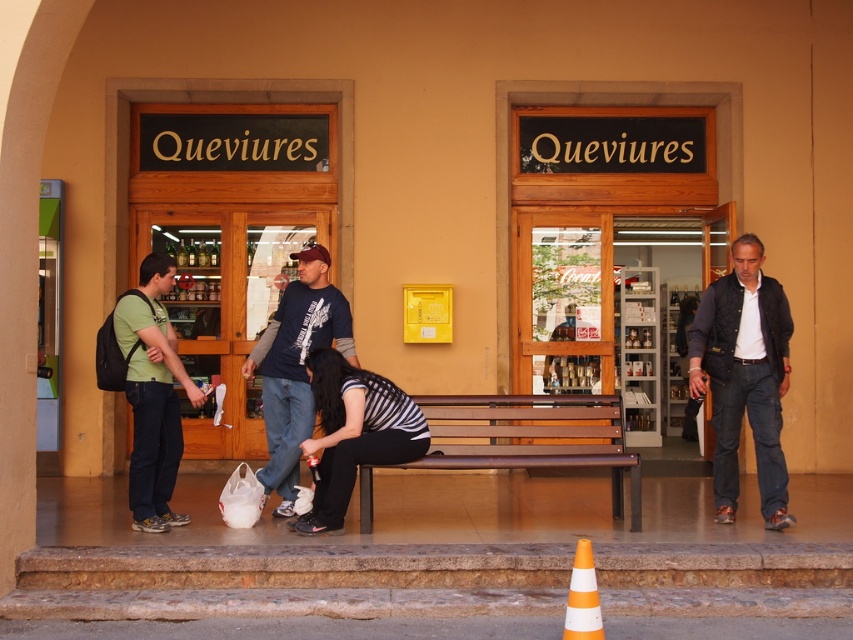
Question: Where is brown stone stairs at lower center located in relation to brown wooden bench at center in the image?

Choices:
 (A) below
 (B) above

Answer: (A)

Question: Can you confirm if matte green t-shirt at left is positioned to the left of dark blue t-shirt at center?

Choices:
 (A) yes
 (B) no

Answer: (A)

Question: Among these points, which one is farthest from the camera?

Choices:
 (A) (764, 385)
 (B) (351, 380)

Answer: (A)

Question: Which object is farther from the camera taking this photo?

Choices:
 (A) brown stone stairs at lower center
 (B) brown wooden bench at center

Answer: (B)

Question: Which of the following is the farthest from the observer?

Choices:
 (A) brown stone stairs at lower center
 (B) dark blue t-shirt at center
 (C) striped fabric shirt at center

Answer: (B)

Question: Can you confirm if brown wooden bench at center is positioned to the right of matte green t-shirt at left?

Choices:
 (A) no
 (B) yes

Answer: (B)